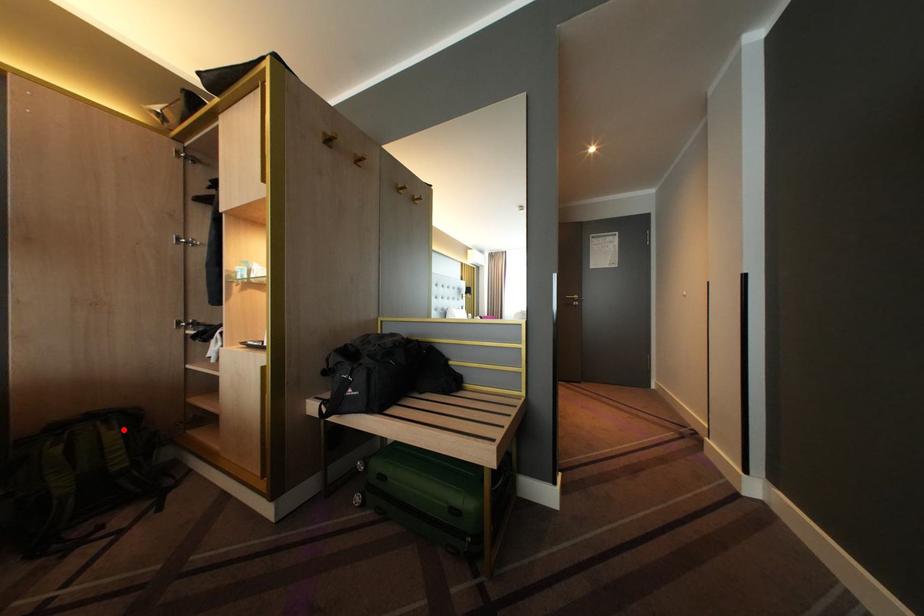
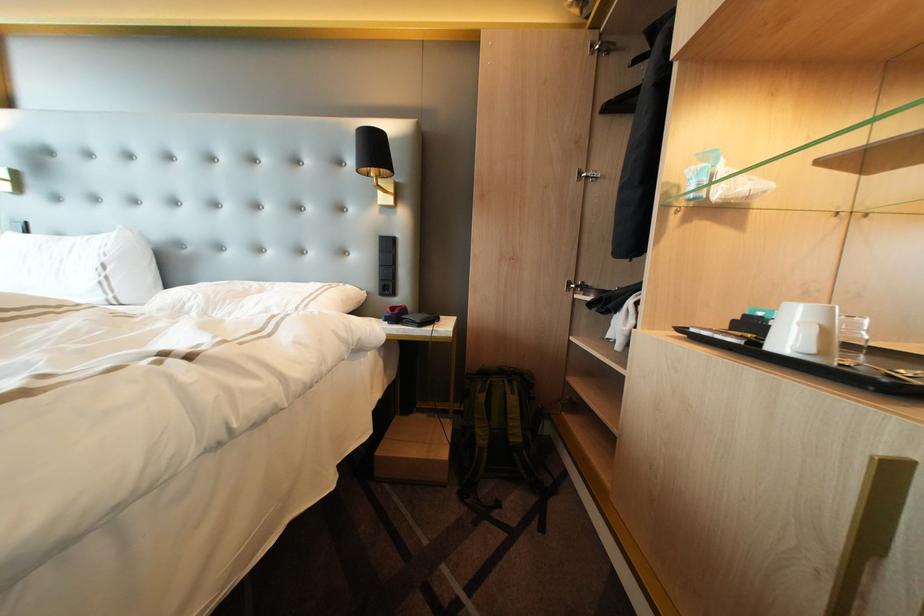
In the second image, find the point that corresponds to the highlighted location in the first image.

(525, 394)